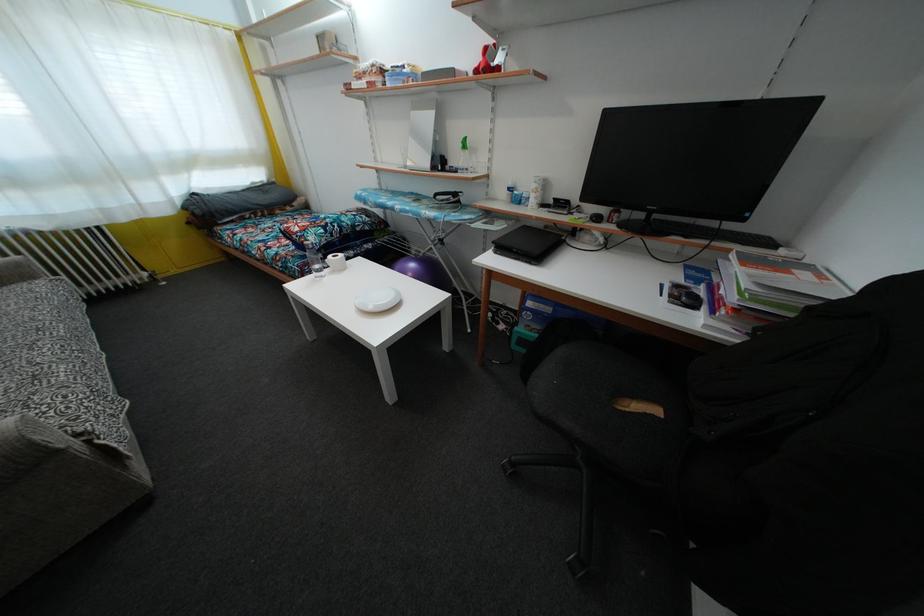
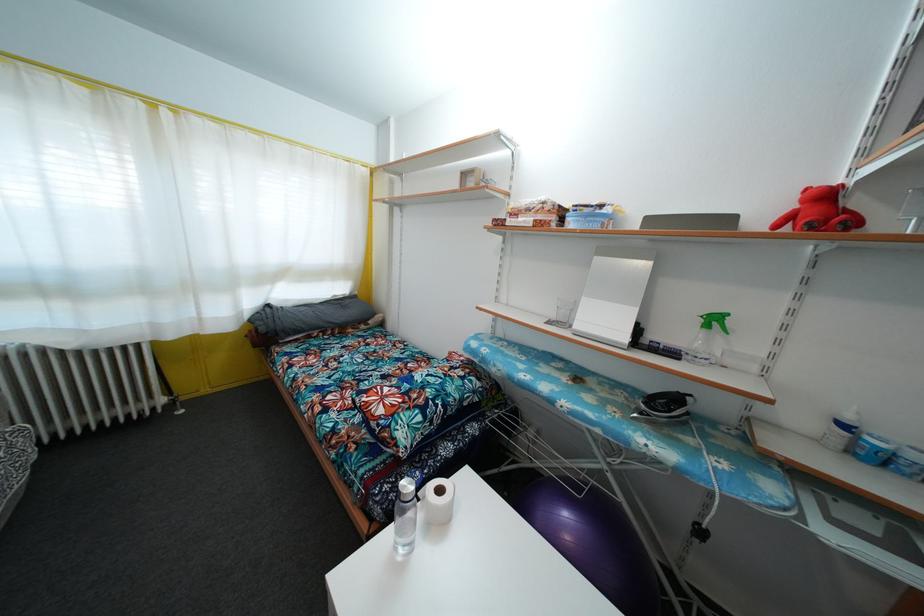
Find the pixel in the second image that matches the point at 445,248 in the first image.

(704, 540)